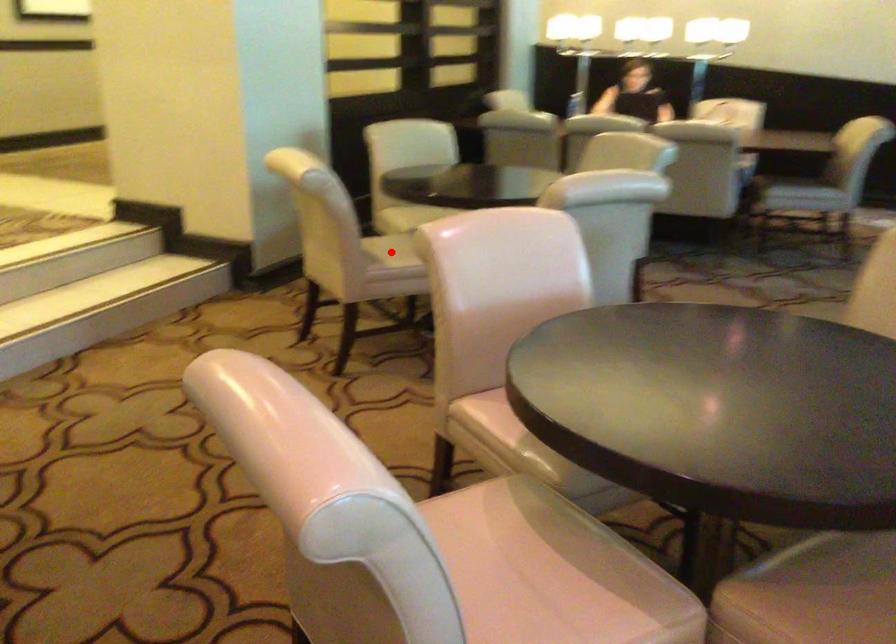
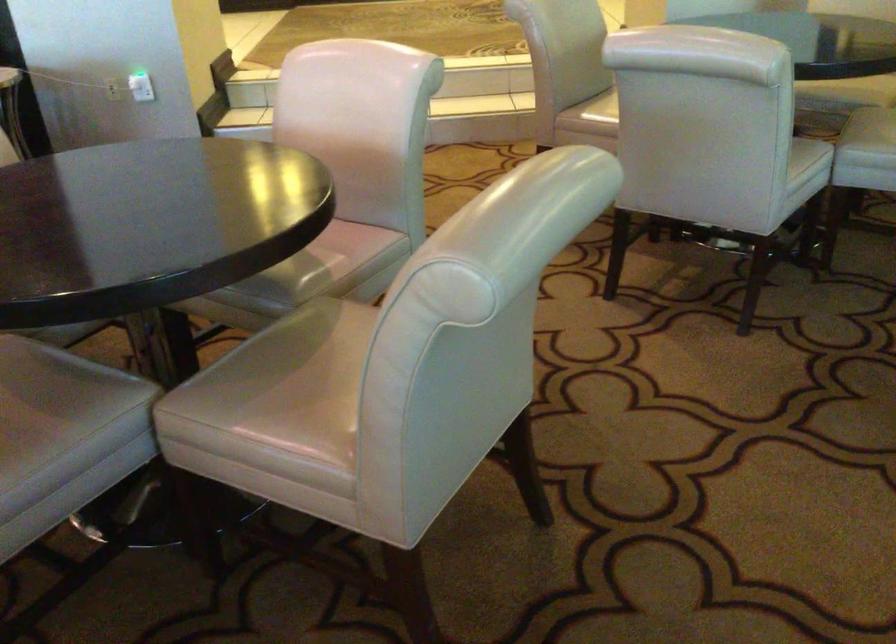
Question: I am providing you with two images of the same scene from different viewpoints. A red point is marked on the first image. At the location where the point appears in image 1, is it still visible in image 2?

Choices:
 (A) Yes
 (B) No

Answer: (B)